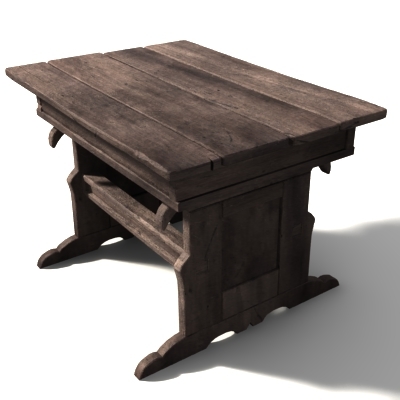
Image resolution: width=400 pixels, height=400 pixels. I want to click on table, so click(x=223, y=121).